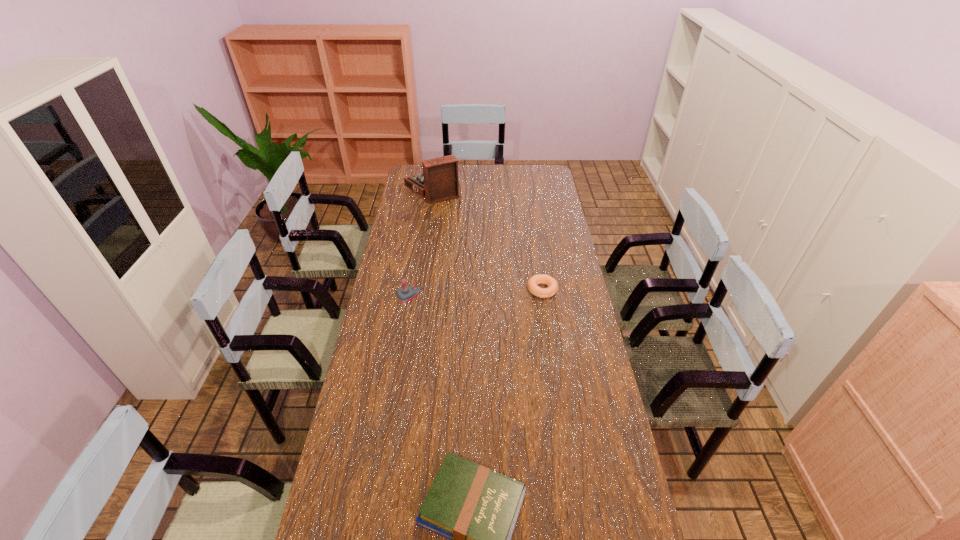
Locate an element on the screen. This screenshot has height=540, width=960. joystick located in the left edge section of the desktop is located at coordinates (405, 294).

Locate an element on the screen. This screenshot has width=960, height=540. object located in the right edge section of the desktop is located at coordinates (535, 280).

Image resolution: width=960 pixels, height=540 pixels. In order to click on object located at the far left corner in this screenshot , I will do `click(438, 182)`.

What are the coordinates of `vacant space at the far edge` in the screenshot? It's located at (x=472, y=172).

You are a GUI agent. You are given a task and a screenshot of the screen. Output one action in this format:
    pyautogui.click(x=<x>, y=<y>)
    Task: Click on the vacant region at the left edge of the desktop
    The image size is (960, 540).
    Given the screenshot: What is the action you would take?
    pyautogui.click(x=388, y=429)

Locate an element on the screen. The height and width of the screenshot is (540, 960). vacant space at the right edge of the desktop is located at coordinates (571, 368).

Where is `vacant area between the joystick and the farthest object`? This screenshot has width=960, height=540. vacant area between the joystick and the farthest object is located at coordinates [429, 240].

Locate an element on the screen. The width and height of the screenshot is (960, 540). unoccupied position between the tallest object and the joystick is located at coordinates (429, 240).

The width and height of the screenshot is (960, 540). Find the location of `free space between the third shortest object and the tallest object`. free space between the third shortest object and the tallest object is located at coordinates (429, 240).

The image size is (960, 540). Identify the location of empty location between the joystick and the phonograph record. (429, 240).